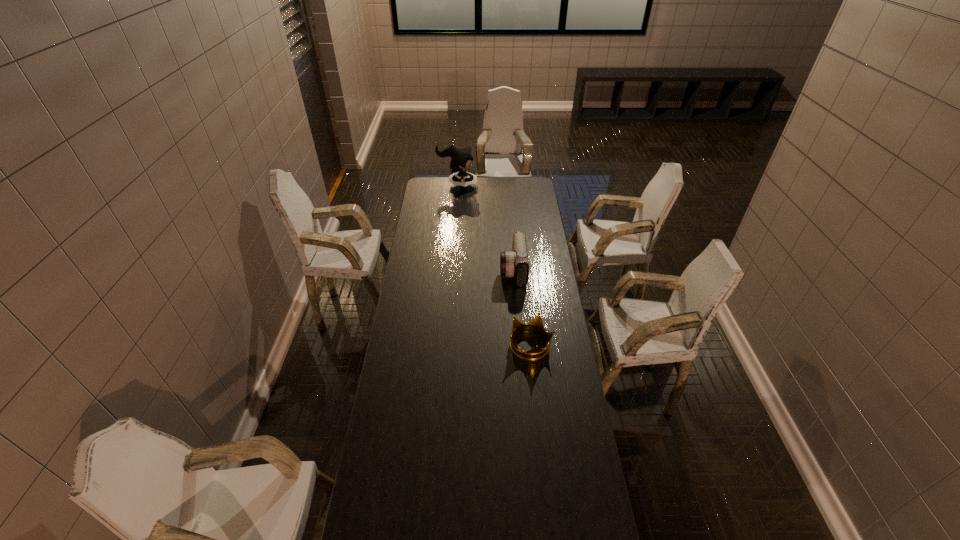
Image resolution: width=960 pixels, height=540 pixels. Identify the location of blank region between the second shortest object and the shortest object. (522, 308).

What are the coordinates of `free space that is in between the second tallest object and the crown` in the screenshot? It's located at (522, 308).

Identify the location of unoccupied area between the farthest object and the shortest object. This screenshot has width=960, height=540. (494, 265).

Locate which object is the closest to the camcorder. Please provide its 2D coordinates. Your answer should be formatted as a tuple, i.e. [(x, y)], where the tuple contains the x and y coordinates of a point satisfying the conditions above.

[(536, 324)]

Locate an element on the screen. This screenshot has width=960, height=540. object that is the closest to the farthest object is located at coordinates (514, 263).

Where is `blank space that satisfies the following two spatial constraints: 1. at the face of the nearest object; 2. on the right side of the tallest object`? This screenshot has width=960, height=540. blank space that satisfies the following two spatial constraints: 1. at the face of the nearest object; 2. on the right side of the tallest object is located at coordinates (445, 346).

I want to click on vacant position in the image that satisfies the following two spatial constraints: 1. on the back side of the crown; 2. on the surface of the camcorder, so click(x=522, y=270).

In order to click on vacant space that satisfies the following two spatial constraints: 1. on the surface of the second tallest object; 2. on the left side of the shortest object in this screenshot , I will do `click(519, 346)`.